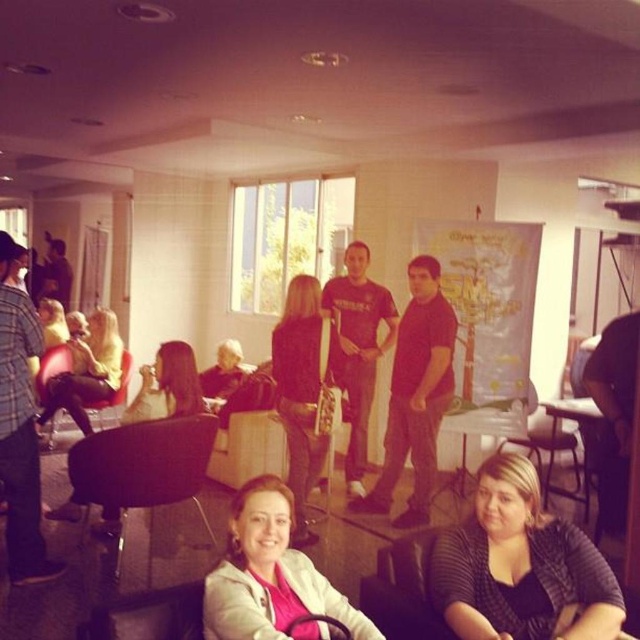
Question: Can you confirm if glossy plastic table at center is positioned to the right of matte black hairdryer at center?

Choices:
 (A) yes
 (B) no

Answer: (A)

Question: Which point is closer to the camera taking this photo?

Choices:
 (A) (124, 371)
 (B) (296, 285)
 (C) (595, 417)
 (D) (484, 632)

Answer: (D)

Question: Which point is farther from the camera taking this photo?

Choices:
 (A) (52, 392)
 (B) (554, 438)
 (C) (552, 458)
 (D) (106, 444)

Answer: (A)

Question: Is matte black hairdryer at left to the right of matte black chair at lower center from the viewer's perspective?

Choices:
 (A) yes
 (B) no

Answer: (B)

Question: Can you confirm if black leather chair at lower left is positioned to the right of matte black chair at lower center?

Choices:
 (A) yes
 (B) no

Answer: (B)

Question: Which point is farther from the camera taking this photo?

Choices:
 (A) (x=83, y=433)
 (B) (x=547, y=486)

Answer: (A)